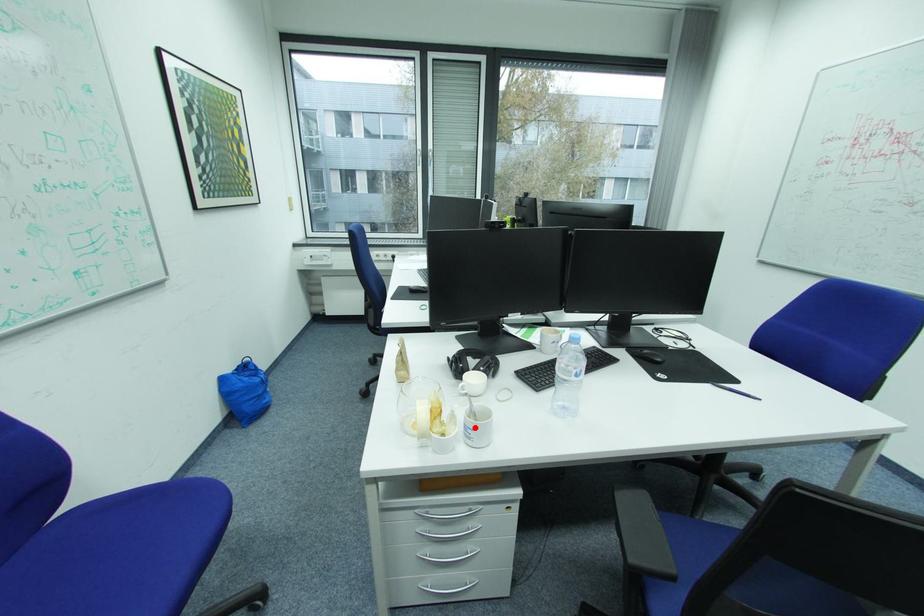
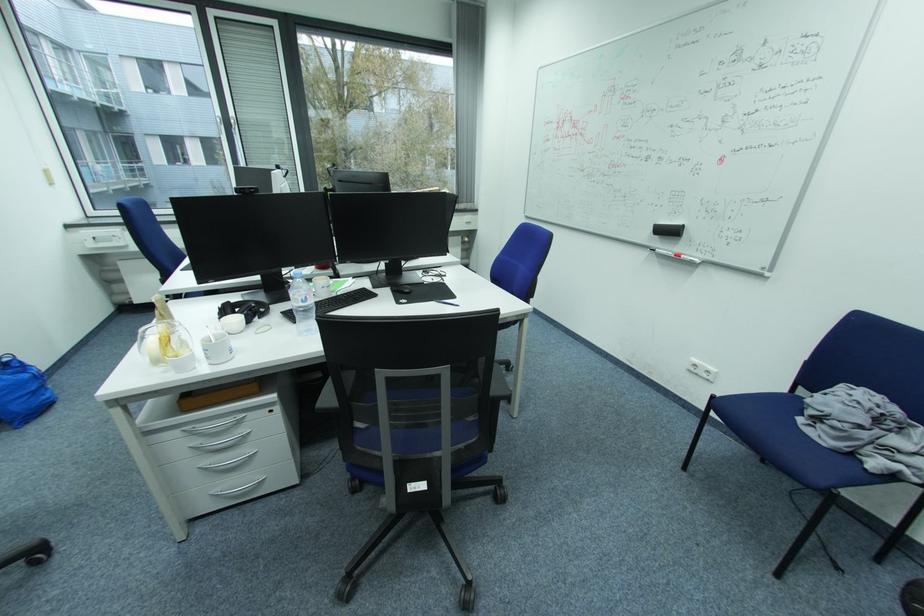
Locate, in the second image, the point that corresponds to the highlighted location in the first image.

(213, 351)